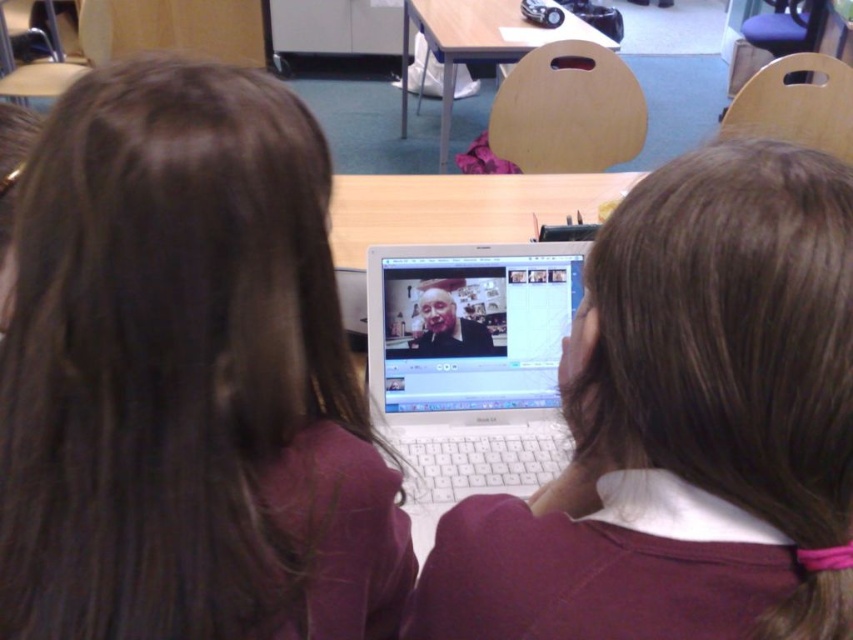
Does maroon sweater at center have a smaller size compared to white plastic laptop at center?

Incorrect, maroon sweater at center is not smaller in size than white plastic laptop at center.

Which is in front, point (561, 592) or point (474, 300)?

Positioned in front is point (561, 592).

Find the location of `maroon sweater at center`. maroon sweater at center is located at coordinates (685, 426).

Is maroon sweater at center bigger than smooth skin face at center?

Correct, maroon sweater at center is larger in size than smooth skin face at center.

What do you see at coordinates (685, 426) in the screenshot? I see `maroon sweater at center` at bounding box center [685, 426].

Find the location of a particular element. The image size is (853, 640). maroon sweater at center is located at coordinates (685, 426).

Does white plastic laptop at center lie in front of wooden table at center?

Yes.

Does point (405, 368) come behind point (496, 32)?

No, it is not.

What do you see at coordinates (469, 365) in the screenshot? The height and width of the screenshot is (640, 853). I see `white plastic laptop at center` at bounding box center [469, 365].

This screenshot has height=640, width=853. Identify the location of white plastic laptop at center. (469, 365).